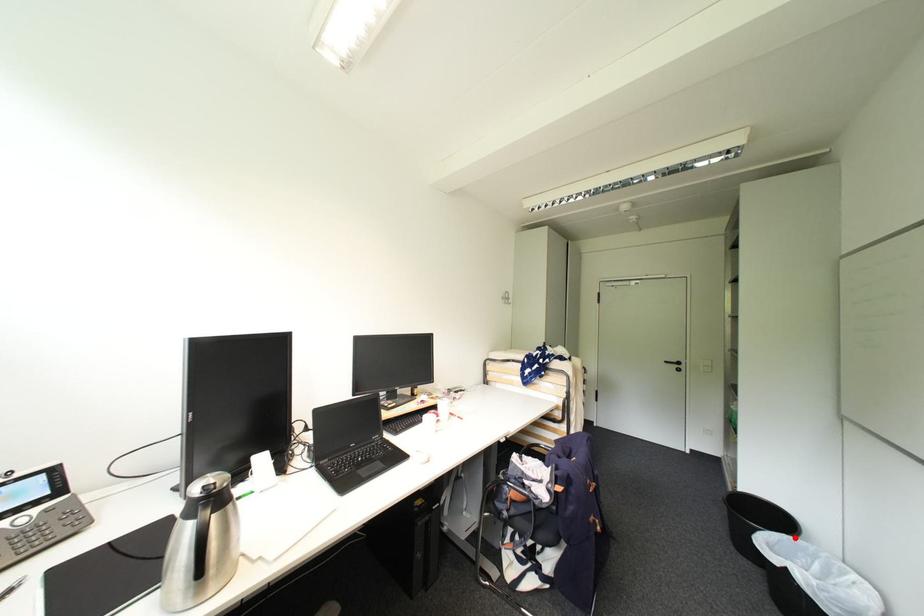
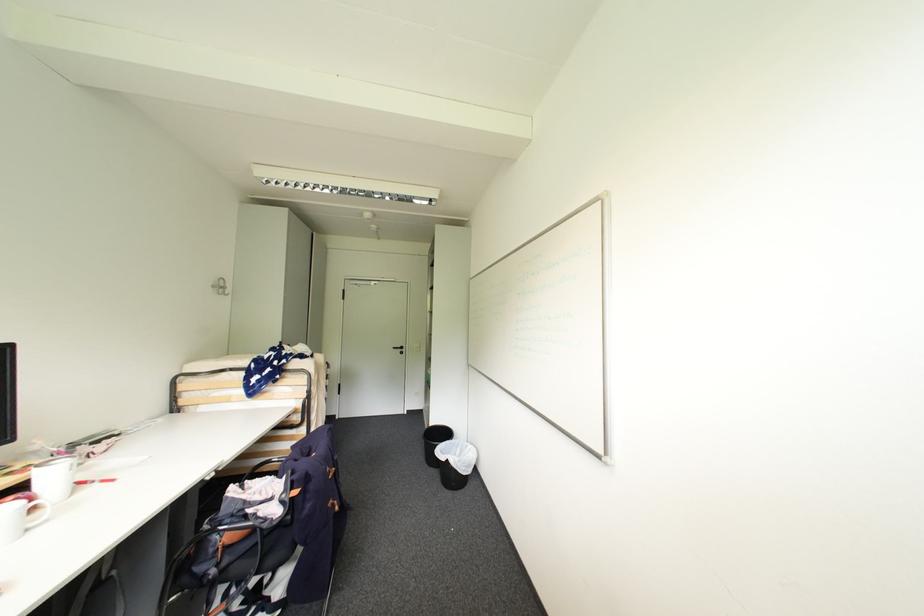
Locate, in the second image, the point that corresponds to the highlighted location in the first image.

(456, 442)